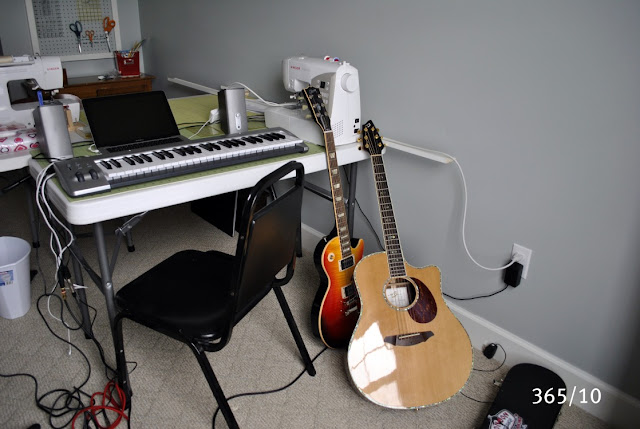
Identify the location of garbage can. Image resolution: width=640 pixels, height=429 pixels. (10, 300).